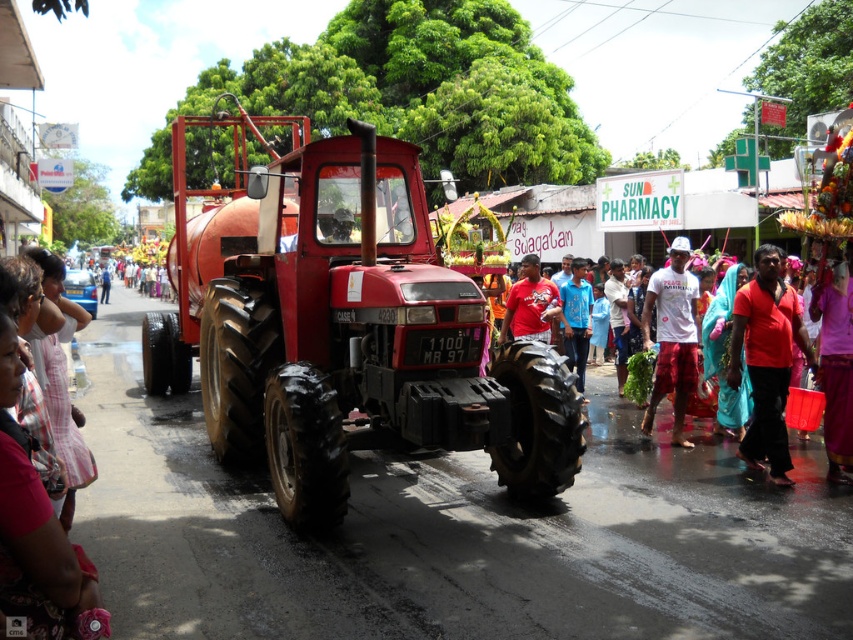
Between red fabric cloth at center and red matte shirt at center, which one has more height?

With more height is red fabric cloth at center.

Is red fabric cloth at center thinner than red matte shirt at center?

Incorrect, red fabric cloth at center's width is not less than red matte shirt at center's.

Who is more forward, (x=776, y=289) or (x=775, y=252)?

Positioned in front is point (x=775, y=252).

You are a GUI agent. You are given a task and a screenshot of the screen. Output one action in this format:
    pyautogui.click(x=<x>, y=<y>)
    Task: Click on the red fabric cloth at center
    This screenshot has width=853, height=640.
    Given the screenshot: What is the action you would take?
    pyautogui.click(x=766, y=362)

Which is more to the left, red fabric cloth at center or white matte t-shirt at center?

white matte t-shirt at center is more to the left.

Which is behind, point (837, 477) or point (647, 426)?

The point (647, 426) is behind.

This screenshot has width=853, height=640. In order to click on red fabric cloth at center in this screenshot , I will do `click(766, 362)`.

Does point (337, 464) come closer to viewer compared to point (672, 294)?

Yes, it is in front of point (672, 294).

Which is more to the right, matte red tractor at center or white matte t-shirt at center?

Positioned to the right is white matte t-shirt at center.

Which is behind, point (331, 220) or point (660, 305)?

The point (660, 305) is more distant.

Locate an element on the screen. matte red tractor at center is located at coordinates (347, 326).